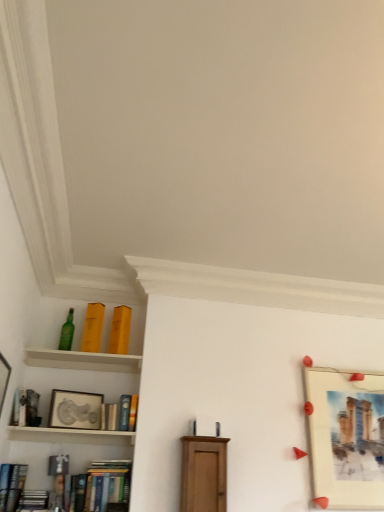
Question: In the image, is matte wood cabinet at center positioned in front of or behind matte yellow book at upper left, marked as the eighth book in a bottom-to-top arrangement?

Choices:
 (A) front
 (B) behind

Answer: (A)

Question: From a real-world perspective, is matte wood cabinet at center positioned above or below matte yellow book at upper left, marked as the eighth book in a bottom-to-top arrangement?

Choices:
 (A) below
 (B) above

Answer: (A)

Question: Estimate the real-world distances between objects in this image. Which object is closer to the matte silver picture frame at upper left, which is the 1th picture frame in left-to-right order?

Choices:
 (A) hardcover book at center-left, arranged as the 5th book when ordered from the bottom
 (B) hardcover book at lower left, arranged as the eighth book when viewed from the top
 (C) hardcover books at lower left, marked as the 7th book in a top-to-bottom arrangement
 (D) hardcover books at lower left, acting as the 6th book starting from the top
 (E) matte wood cabinet at center

Answer: (A)

Question: Estimate the real-world distances between objects in this image. Which object is farther from the white wooden shelf at lower left?

Choices:
 (A) matte yellow book at upper left, marked as the eighth book in a bottom-to-top arrangement
 (B) wooden shelf at upper left
 (C) hardcover book at left, placed as the sixth book when sorted from bottom to top
 (D) hardcover books at lower left, acting as the 6th book starting from the top
 (E) yellow matte book at upper left, positioned as the second book in top-to-bottom order

Answer: (E)